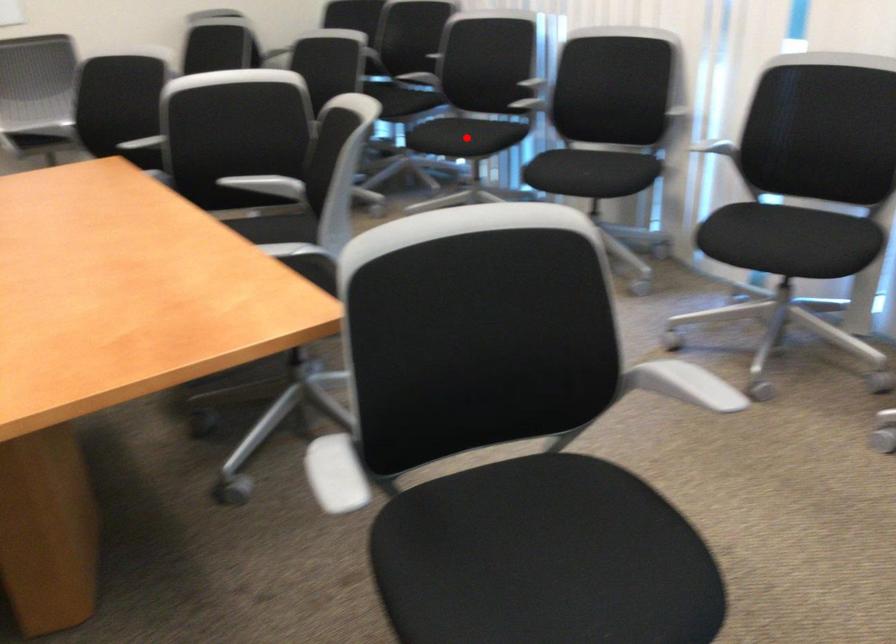
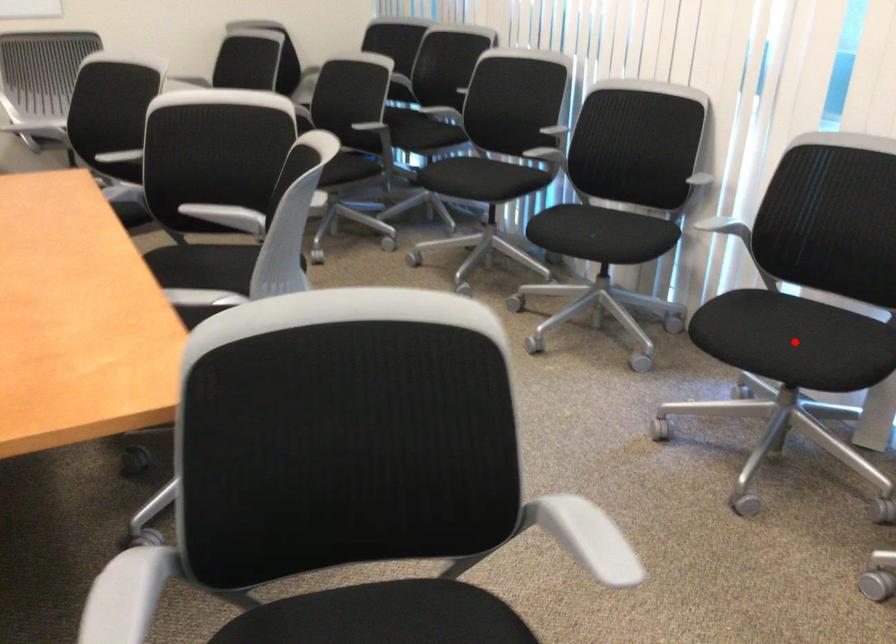
I am providing you with two images of the same scene from different viewpoints. A red point is marked on the first image and another point is marked on the second image. Does the point marked in image1 correspond to the same location as the one in image2?

No